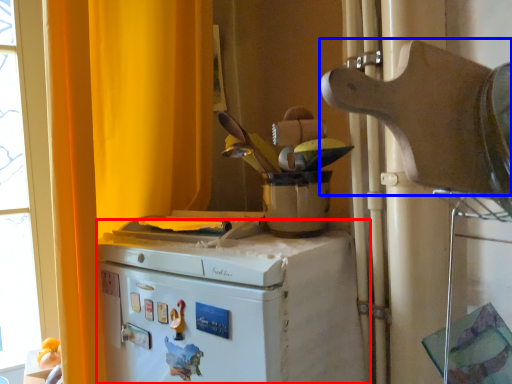
Question: Among these objects, which one is farthest to the camera, home appliance (highlighted by a red box) or appliance (highlighted by a blue box)?

Choices:
 (A) home appliance
 (B) appliance

Answer: (A)